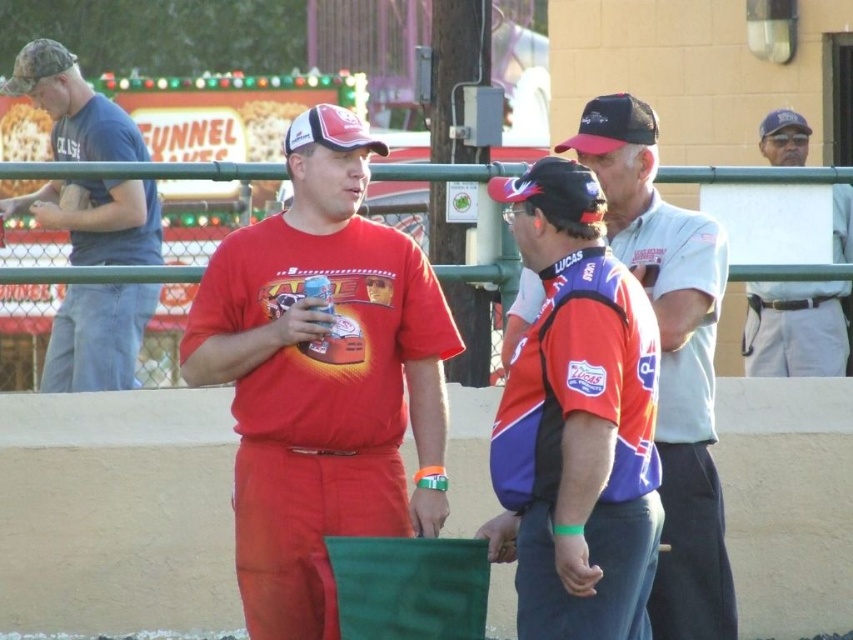
Question: Can you confirm if matte red baseball cap at center is positioned to the right of white matte baseball cap at center?

Choices:
 (A) no
 (B) yes

Answer: (B)

Question: Is matte blue shirt at left in front of black fabric baseball cap at upper right?

Choices:
 (A) no
 (B) yes

Answer: (B)

Question: Among these points, which one is farthest from the camera?

Choices:
 (A) (628, 134)
 (B) (126, 339)
 (C) (380, 148)

Answer: (B)

Question: Which object is the closest to the white matte baseball cap at center?

Choices:
 (A) matte red baseball cap at center
 (B) camo fabric baseball cap at upper left

Answer: (A)

Question: Which point is farther from the camera taking this photo?

Choices:
 (A) (772, 131)
 (B) (35, 42)
 (C) (560, 202)
 (D) (605, 316)

Answer: (A)

Question: From the image, what is the correct spatial relationship of camo fabric baseball cap at upper left in relation to black fabric baseball cap at upper right?

Choices:
 (A) right
 (B) left

Answer: (B)